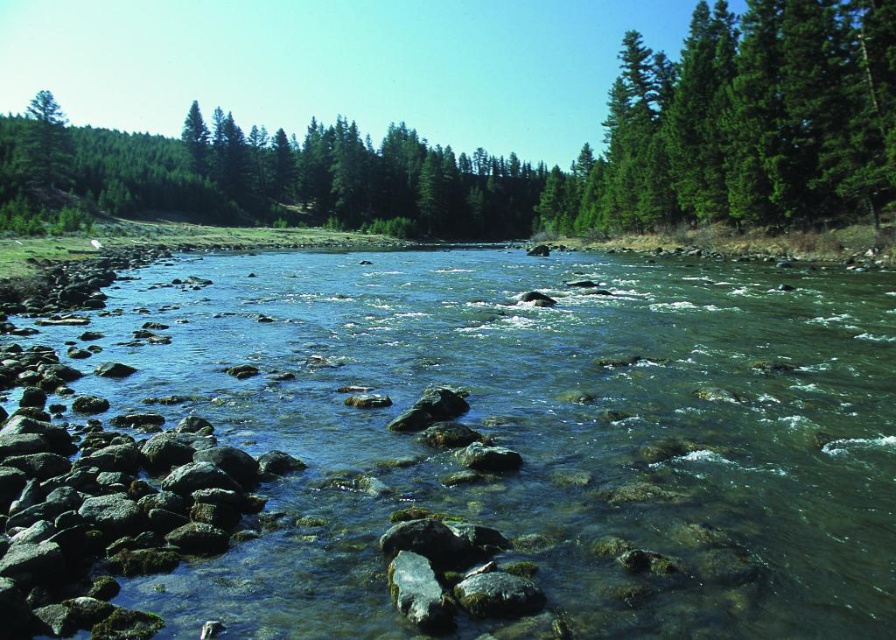
From the picture: You are standing at the center of the river and looking towards the upper right corner of the image. What do you see in the direction of the point with coordinates (x=743, y=124)?

In the direction of the point with coordinates (x=743, y=124), you see a green textured tree at upper right.

You are standing at the riverbank and want to throw a pebble to both the point at coordinates (255, 445) and the point at coordinates (642, 221). Which point will require throwing the pebble farther?

The point at coordinates (642, 221) will require throwing the pebble farther because it is farther from the viewer compared to the point at coordinates (255, 445).

You are standing on the bank of the river and want to cross to the other side. You see the clear water at center and the green matte tree at upper left. Which object is closer to your current position?

The clear water at center is closer to your current position because it is to the right of the green matte tree at upper left, which is located further away on the upper left side of the scene.